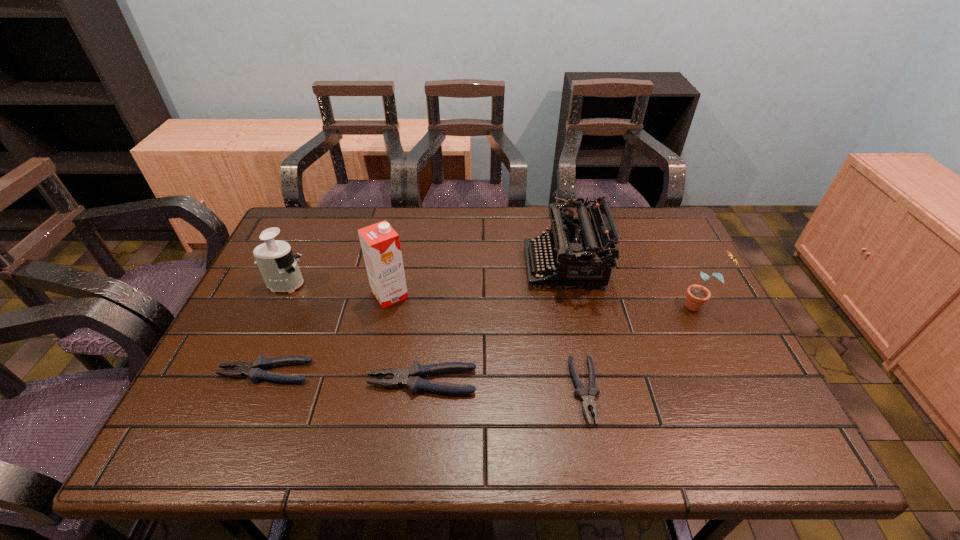
Please point a spot on the right to add another pliers. Please provide its 2D coordinates. Your answer should be formatted as a tuple, i.e. [(x, y)], where the tuple contains the x and y coordinates of a point satisfying the conditions above.

[(755, 401)]